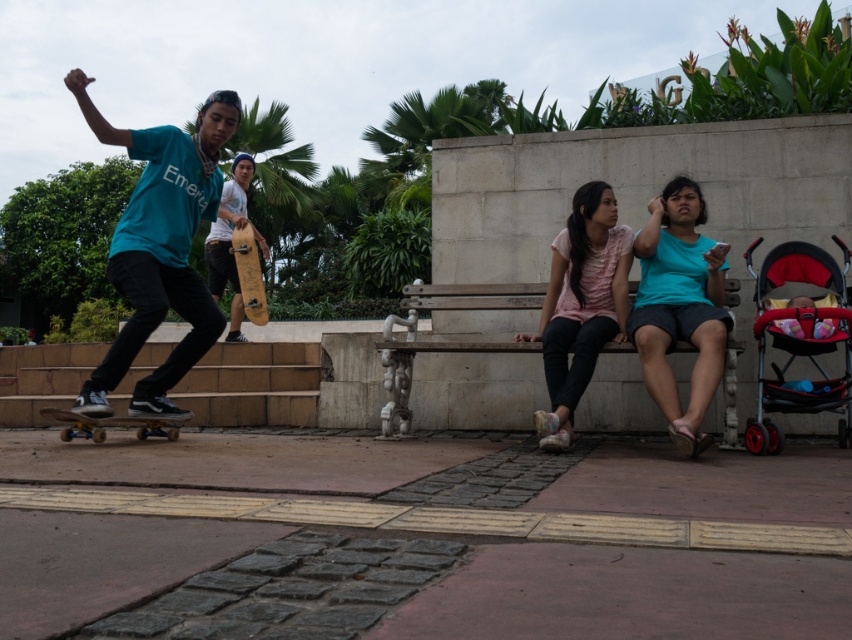
Question: Does wooden skateboard at lower left lie in front of wooden skateboard at center?

Choices:
 (A) yes
 (B) no

Answer: (A)

Question: Can you confirm if teal matte shirt at left is smaller than wooden skateboard at center?

Choices:
 (A) no
 (B) yes

Answer: (A)

Question: Considering the real-world distances, which object is farthest from the red plastic baby carriage at lower right?

Choices:
 (A) teal matte shirt at center
 (B) wooden skateboard at lower left
 (C) teal matte shirt at left
 (D) wooden skateboard at center

Answer: (D)

Question: Considering the real-world distances, which object is closest to the teal matte shirt at center?

Choices:
 (A) wooden skateboard at lower left
 (B) red plastic baby carriage at lower right
 (C) wooden skateboard at center
 (D) teal matte shirt at left

Answer: (B)

Question: Does red plastic baby carriage at lower right have a lesser width compared to wooden skateboard at center?

Choices:
 (A) no
 (B) yes

Answer: (A)

Question: Based on their relative distances, which object is nearer to the teal matte shirt at center?

Choices:
 (A) wooden skateboard at lower left
 (B) red plastic baby carriage at lower right
 (C) teal matte shirt at left
 (D) wooden skateboard at center

Answer: (B)